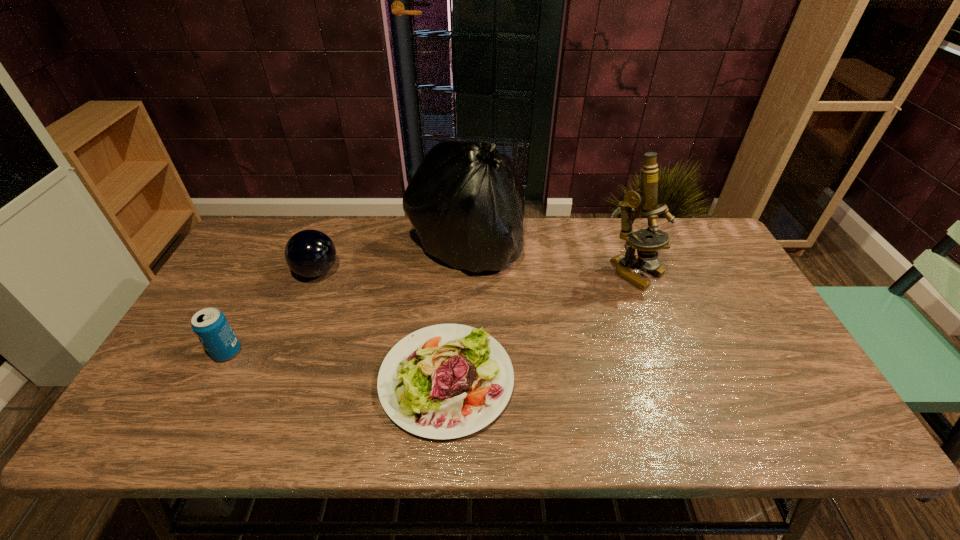
Image resolution: width=960 pixels, height=540 pixels. Find the location of `plastic bag`. plastic bag is located at coordinates (466, 202).

Identify the location of the rightmost object. This screenshot has width=960, height=540. (645, 198).

Where is `bowling ball`? Image resolution: width=960 pixels, height=540 pixels. bowling ball is located at coordinates (309, 253).

Locate an element on the screen. This screenshot has height=540, width=960. soda can is located at coordinates (210, 325).

The height and width of the screenshot is (540, 960). In order to click on the shortest object in this screenshot , I will do `click(445, 381)`.

Where is `vacant space located on the right of the plastic bag`? This screenshot has height=540, width=960. vacant space located on the right of the plastic bag is located at coordinates (643, 247).

Find the location of a particular element. vacant space situated 0.350m on the left of the rightmost object is located at coordinates (494, 272).

The image size is (960, 540). I want to click on vacant region located on the side of the second object from left to right with the finger holes, so click(432, 272).

Locate an element on the screen. vacant space positioned on the back of the leftmost object is located at coordinates [x=245, y=318].

Identify the location of free space located 0.260m on the right of the salad plate. (621, 380).